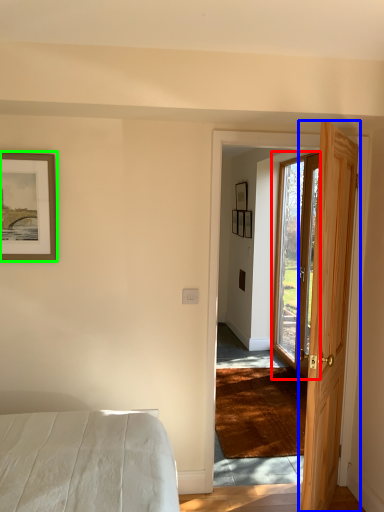
Question: Considering the real-world distances, which object is farthest from door (highlighted by a red box)? door (highlighted by a blue box) or picture frame (highlighted by a green box)?

Choices:
 (A) door
 (B) picture frame

Answer: (B)